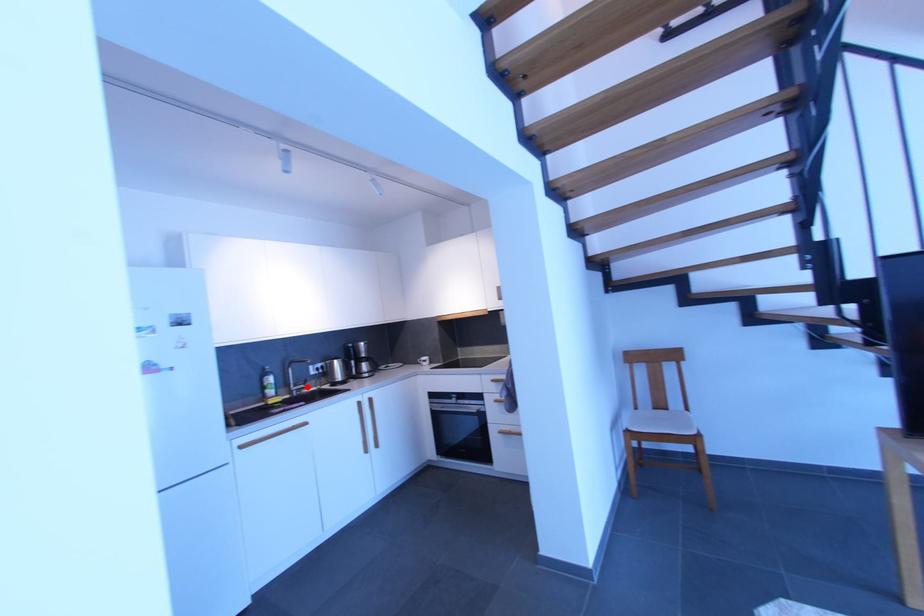
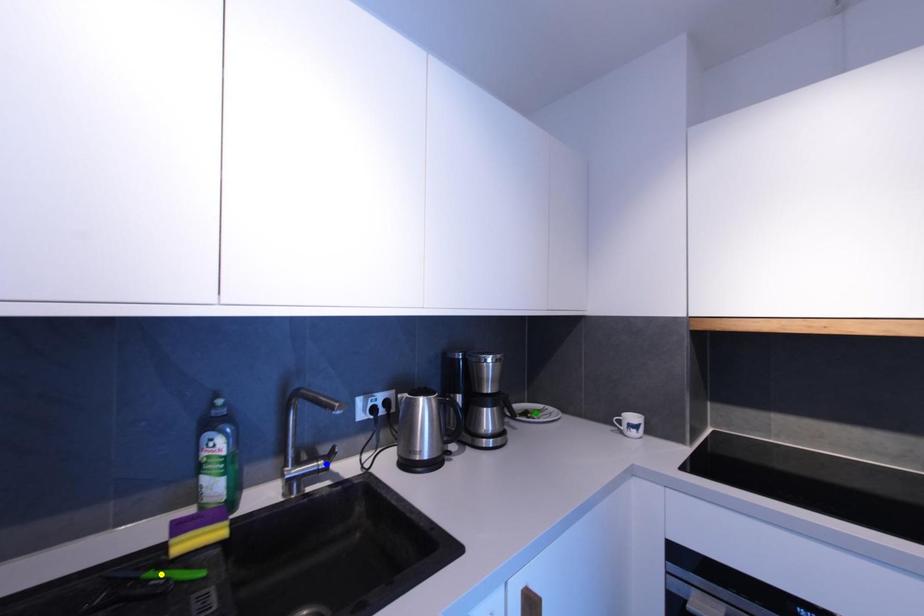
Question: I am providing you with two images of the same scene from different viewpoints. A red point is marked on the first image. You are given multiple points on the second image. Which mark in image 2 goes with the point in image 1?

Choices:
 (A) green point
 (B) yellow point
 (C) blue point

Answer: (C)